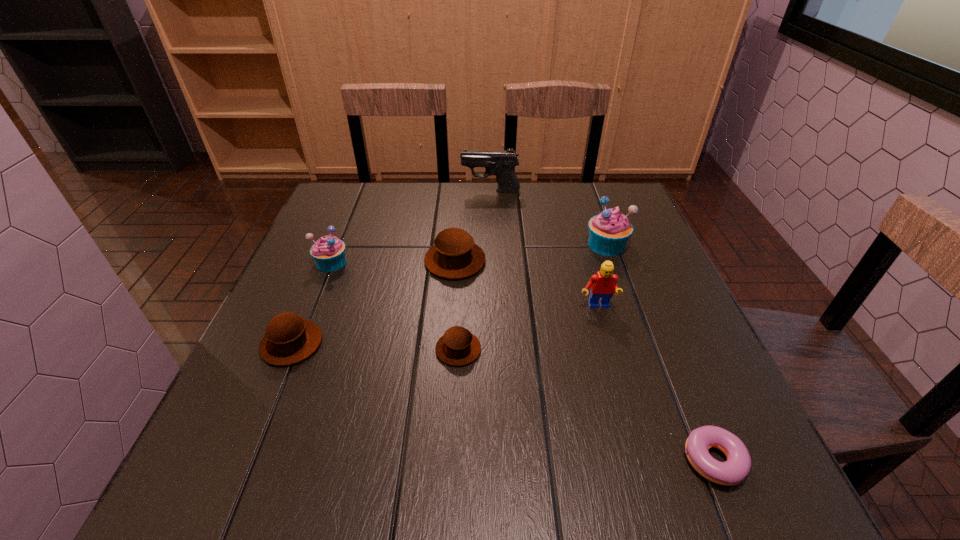
Locate an element on the screen. the farthest object is located at coordinates (500, 163).

This screenshot has width=960, height=540. I want to click on black pistol, so click(500, 163).

Identify the location of the right blue muffin. The width and height of the screenshot is (960, 540). (609, 231).

The width and height of the screenshot is (960, 540). In order to click on the tallest muffin in this screenshot , I will do `click(609, 231)`.

Image resolution: width=960 pixels, height=540 pixels. Find the location of `the fourth nearest object`. the fourth nearest object is located at coordinates (603, 284).

Where is `Lego`? The width and height of the screenshot is (960, 540). Lego is located at coordinates (603, 284).

The width and height of the screenshot is (960, 540). What are the coordinates of `the smaller blue muffin` in the screenshot? It's located at (328, 252).

Find the location of a particular element. This screenshot has height=540, width=960. the farthest brown muffin is located at coordinates (454, 255).

Identify the location of the sixth tallest object. (289, 339).

Locate an element on the screen. The image size is (960, 540). the leftmost brown muffin is located at coordinates (289, 339).